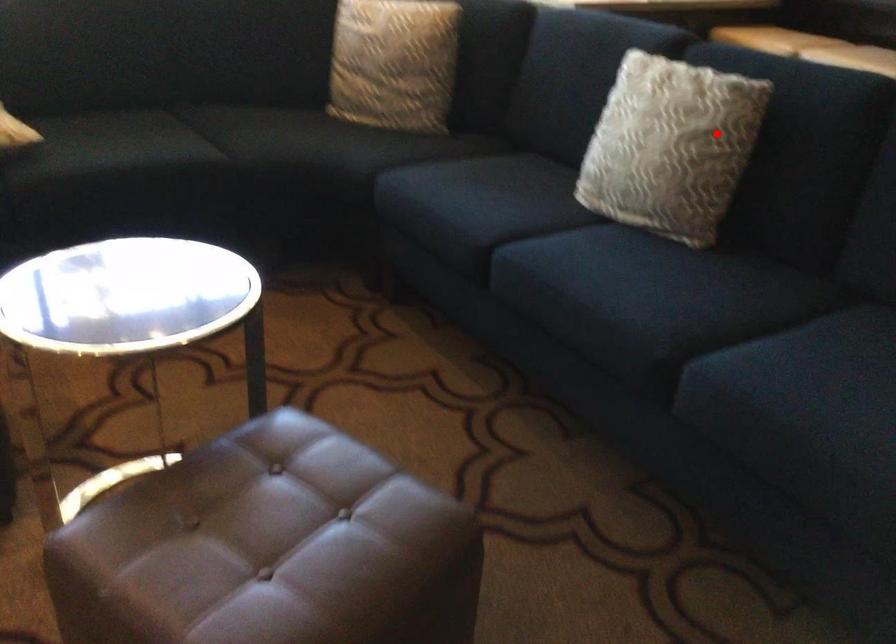
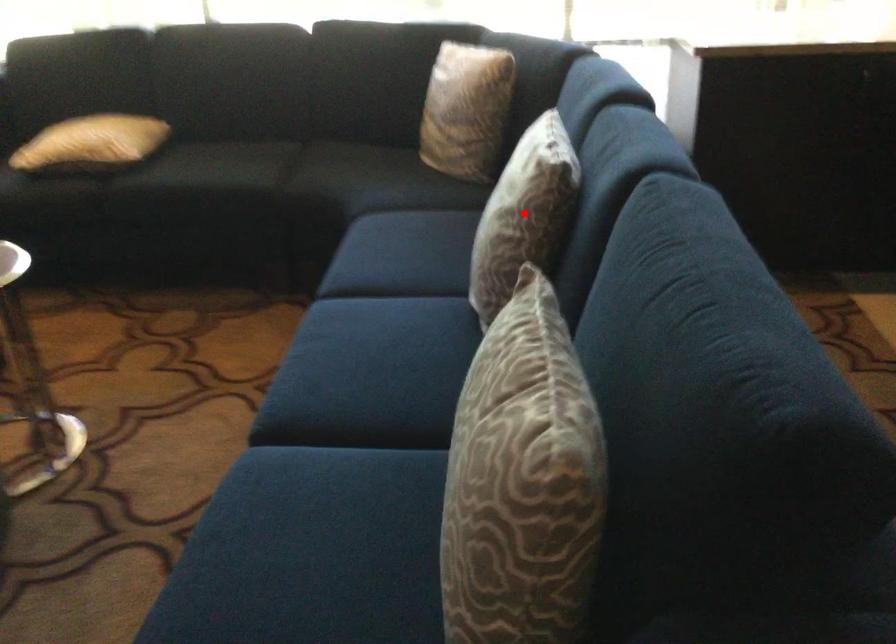
I am providing you with two images of the same scene from different viewpoints. A red point is marked on the first image and another point is marked on the second image. Is the red point in image1 aligned with the point shown in image2?

Yes